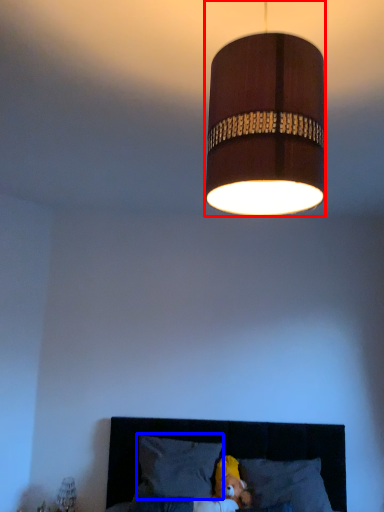
Question: Which object is further to the camera taking this photo, lamp (highlighted by a red box) or pillow (highlighted by a blue box)?

Choices:
 (A) lamp
 (B) pillow

Answer: (B)